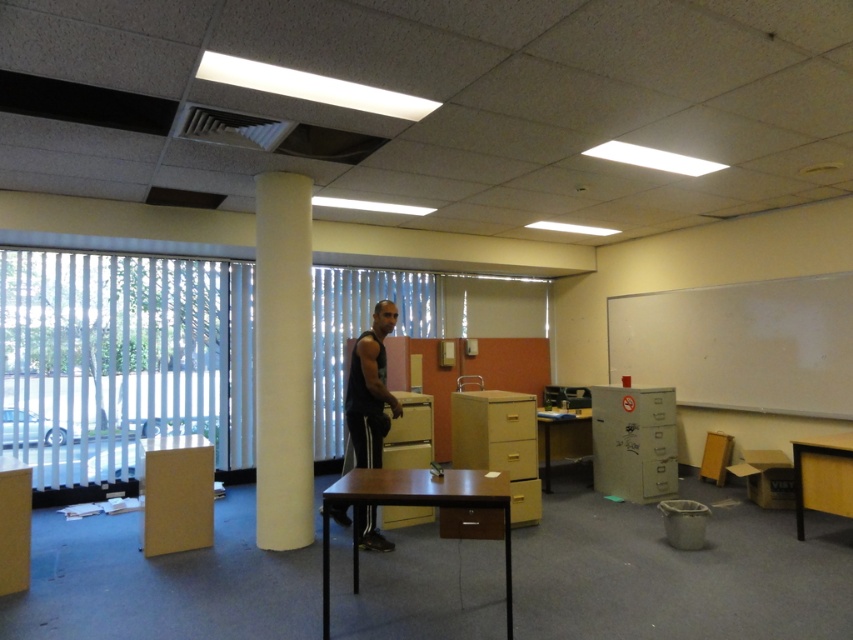
You are a delivery person who just arrived with a package that needs to be placed on a surface. You see the matte yellow cabinet at lower left and the black matte tank top at center. Which object can you place the package on?

The matte yellow cabinet at lower left is not as tall as the black matte tank top at center, so the package can be placed on the matte yellow cabinet at lower left since it is a stable surface.

You are an office assistant who needs to move a large box from the entrance to the storage area. The entrance is near the whiteboard, and the storage area is near the column where the man is standing. You have two options for pathways between the metallic gray file cabinet at right and the matte yellow cabinet at lower left. Which pathway would you choose to ensure the box can pass through without getting stuck?

The metallic gray file cabinet at right is larger in size than the matte yellow cabinet at lower left, so the pathway between the metallic gray file cabinet at right and the matte yellow cabinet at lower left would be wider, allowing the large box to pass through without getting stuck.